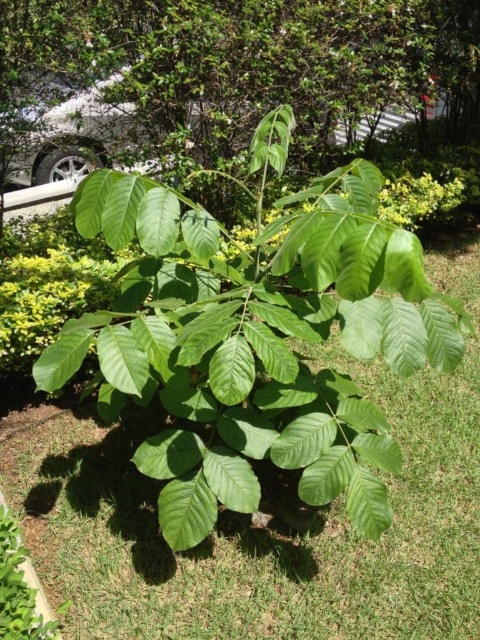
You are standing in a garden and see the green grass at center and the green leafy tree at center. Which one is closer to you?

The green grass at center is closer because it is in front of the green leafy tree at center.

You are standing in front of the plant with large, glossy green leaves and need to move from point A at coordinate point (211, 541) to point B at coordinate point (311, 93). Which point is closer to you as you start your journey?

Point A at coordinate point (211, 541) is closer to you than point B at coordinate point (311, 93), so you will start closer to point A.

You are standing at the center of the image and want to place a small garden gnome exactly where the green grass at center is located. What are the coordinates where you should place the gnome?

The coordinates for the green grass at center are point (253, 525), so you should place the gnome there.